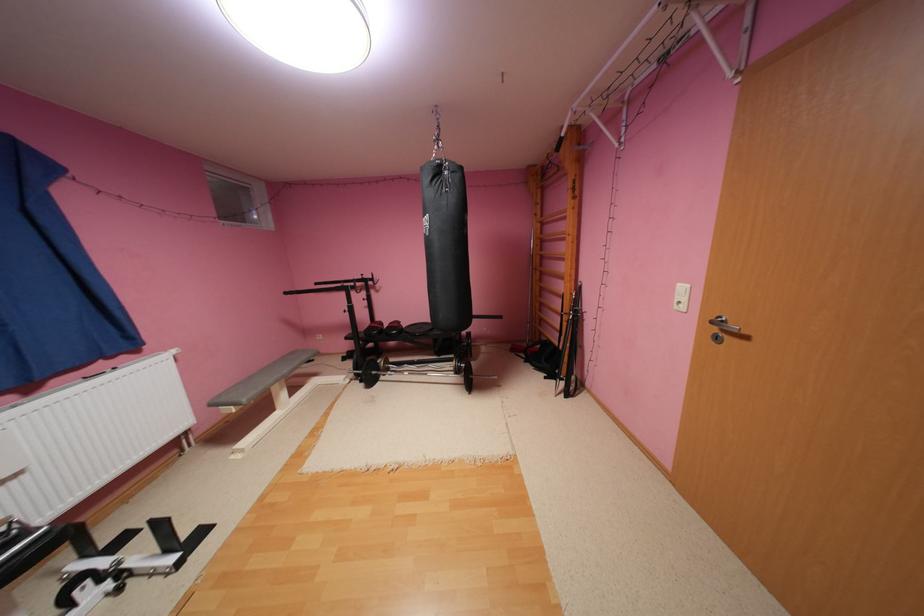
What do you see at coordinates (259, 379) in the screenshot? I see `the grey bench surface` at bounding box center [259, 379].